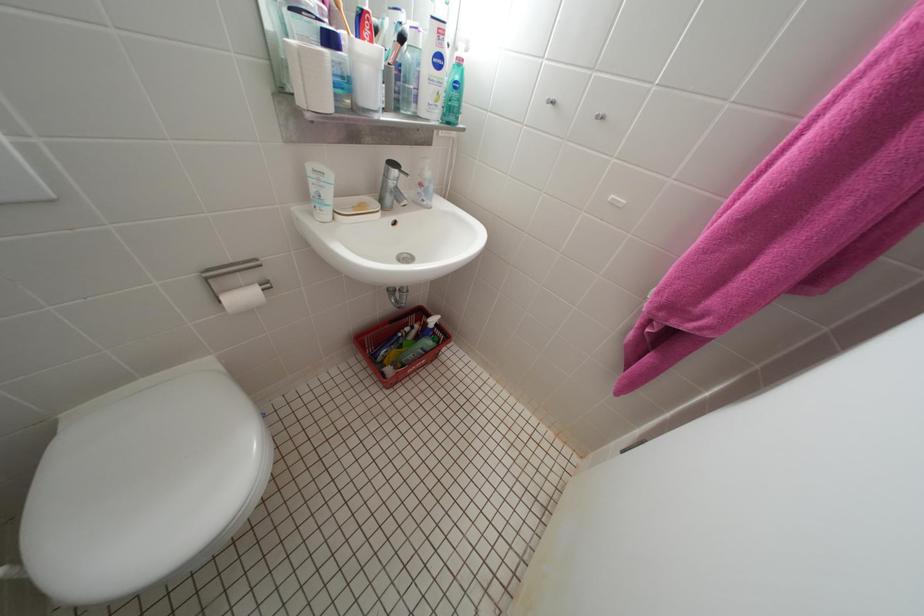
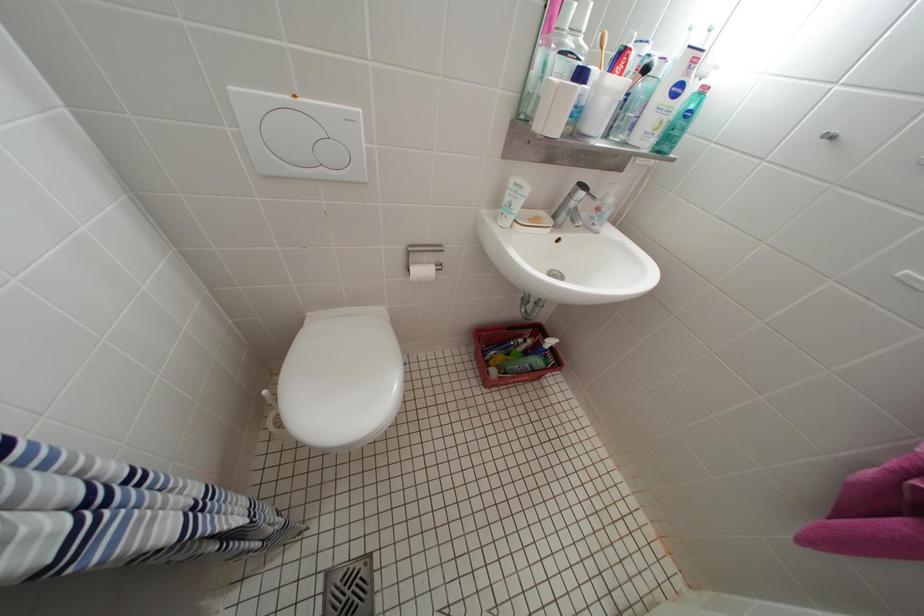
Question: The first image is from the beginning of the video and the second image is from the end. How did the camera likely rotate when shooting the video?

Choices:
 (A) Left
 (B) Right
 (C) Up
 (D) Down

Answer: (A)